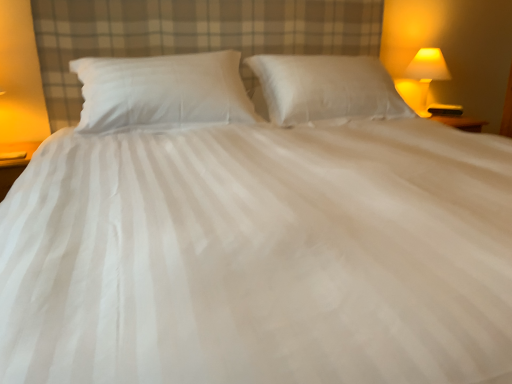
Question: Can you confirm if white soft pillow at center, which appears as the second pillow when viewed from the left, is bigger than white cotton pillow at center, the 2th pillow from the right?

Choices:
 (A) yes
 (B) no

Answer: (A)

Question: Is white soft pillow at center, which appears as the second pillow when viewed from the left, further to camera compared to white cotton pillow at center, the 2th pillow from the right?

Choices:
 (A) yes
 (B) no

Answer: (A)

Question: Is white soft pillow at center, which appears as the second pillow when viewed from the left, not inside white cotton pillow at center, the 2th pillow from the right?

Choices:
 (A) yes
 (B) no

Answer: (A)

Question: Is white soft pillow at center, the 1th pillow in the right-to-left sequence, oriented towards white cotton pillow at center, the 2th pillow from the right?

Choices:
 (A) yes
 (B) no

Answer: (B)

Question: Is white soft pillow at center, which appears as the second pillow when viewed from the left, thinner than white cotton pillow at center, the 2th pillow from the right?

Choices:
 (A) yes
 (B) no

Answer: (A)

Question: Considering the positions of white soft pillow at center, the 1th pillow in the right-to-left sequence, and matte yellow glass lamp at upper right in the image, is white soft pillow at center, the 1th pillow in the right-to-left sequence, bigger or smaller than matte yellow glass lamp at upper right?

Choices:
 (A) big
 (B) small

Answer: (A)

Question: From a real-world perspective, is white soft pillow at center, which appears as the second pillow when viewed from the left, above or below matte yellow glass lamp at upper right?

Choices:
 (A) below
 (B) above

Answer: (B)

Question: In terms of height, does white soft pillow at center, the 1th pillow in the right-to-left sequence, look taller or shorter compared to matte yellow glass lamp at upper right?

Choices:
 (A) tall
 (B) short

Answer: (B)

Question: From the image's perspective, is white soft pillow at center, the 1th pillow in the right-to-left sequence, above or below matte yellow glass lamp at upper right?

Choices:
 (A) above
 (B) below

Answer: (B)

Question: Looking at the image, does matte yellow glass lamp at upper right seem bigger or smaller compared to white cotton pillow at center, the 2th pillow from the right?

Choices:
 (A) big
 (B) small

Answer: (B)

Question: In the image, is matte yellow glass lamp at upper right on the left side or the right side of white cotton pillow at center, the 1th pillow when ordered from left to right?

Choices:
 (A) left
 (B) right

Answer: (B)

Question: Does point (415, 72) appear closer or farther from the camera than point (216, 79)?

Choices:
 (A) closer
 (B) farther

Answer: (B)

Question: In terms of width, does matte yellow glass lamp at upper right look wider or thinner when compared to white cotton pillow at center, the 1th pillow when ordered from left to right?

Choices:
 (A) wide
 (B) thin

Answer: (B)

Question: From a real-world perspective, is white soft pillow at center, the 1th pillow in the right-to-left sequence, above or below white cotton pillow at center, the 2th pillow from the right?

Choices:
 (A) above
 (B) below

Answer: (B)

Question: Considering the positions of point (339, 100) and point (229, 57), is point (339, 100) closer or farther from the camera than point (229, 57)?

Choices:
 (A) closer
 (B) farther

Answer: (B)